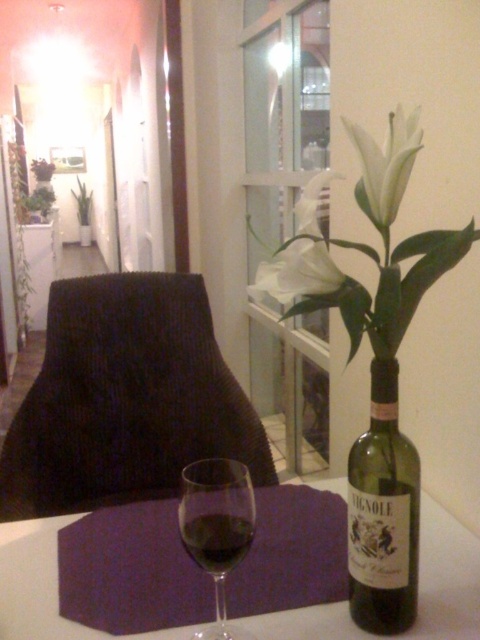
You are setting up a table for a dinner party and need to place a decorative item that requires a surface taller than the table. Given the white glossy table at center and the green glass bottle at right, which object can you use as a surface?

The green glass bottle at right is taller than the white glossy table at center, so you can use it as a surface for the decorative item.

You are a guest at a dinner party and notice the green glass bottle at right and the translucent glass at center on the table. Which object is positioned higher relative to the other?

The green glass bottle at right is positioned above the translucent glass at center.